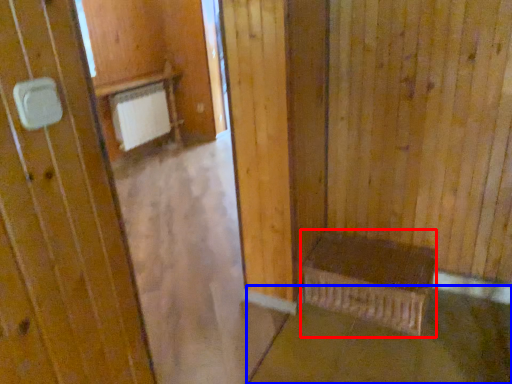
Question: Which point is closer to the camera, furniture (highlighted by a red box) or concrete (highlighted by a blue box)?

Choices:
 (A) furniture
 (B) concrete

Answer: (B)